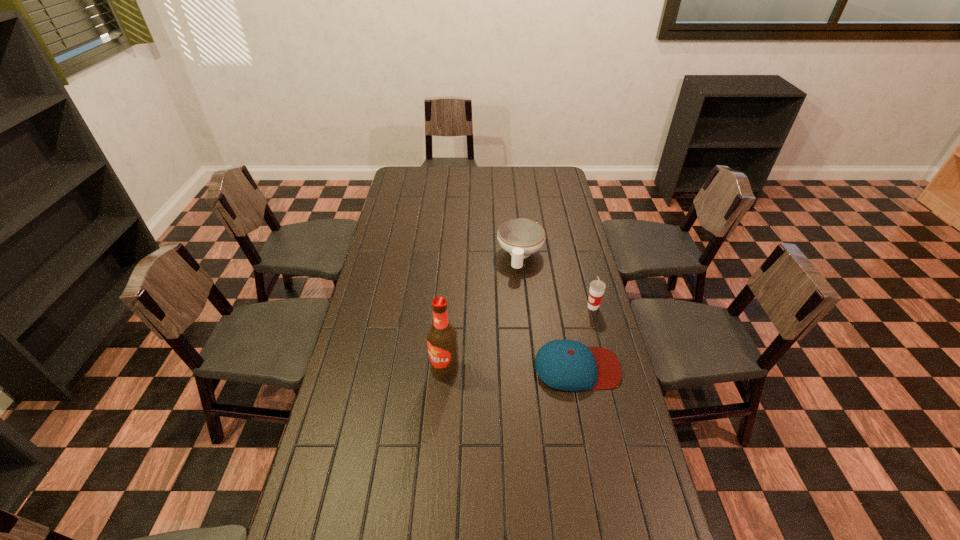
Where is `vacant space located 0.300m on the side of the second farthest object with the logo`? The width and height of the screenshot is (960, 540). vacant space located 0.300m on the side of the second farthest object with the logo is located at coordinates (529, 350).

Find the location of a particular element. The image size is (960, 540). vacant region located on the side with the handle of the second shortest object is located at coordinates (516, 286).

Locate an element on the screen. vacant region located on the side with the handle of the second shortest object is located at coordinates [511, 314].

Find the location of a particular element. free space located on the side with the handle of the second shortest object is located at coordinates (510, 318).

Where is `baseball cap that is at the right edge`? The image size is (960, 540). baseball cap that is at the right edge is located at coordinates (568, 365).

Where is `cup present at the right edge`? cup present at the right edge is located at coordinates (597, 287).

Identify the location of free space at the far edge of the desktop. (507, 171).

Identify the location of free space at the near edge. (447, 507).

Where is `free space at the left edge of the desktop`? Image resolution: width=960 pixels, height=540 pixels. free space at the left edge of the desktop is located at coordinates (375, 343).

Locate an element on the screen. The image size is (960, 540). vacant space at the right edge of the desktop is located at coordinates (568, 195).